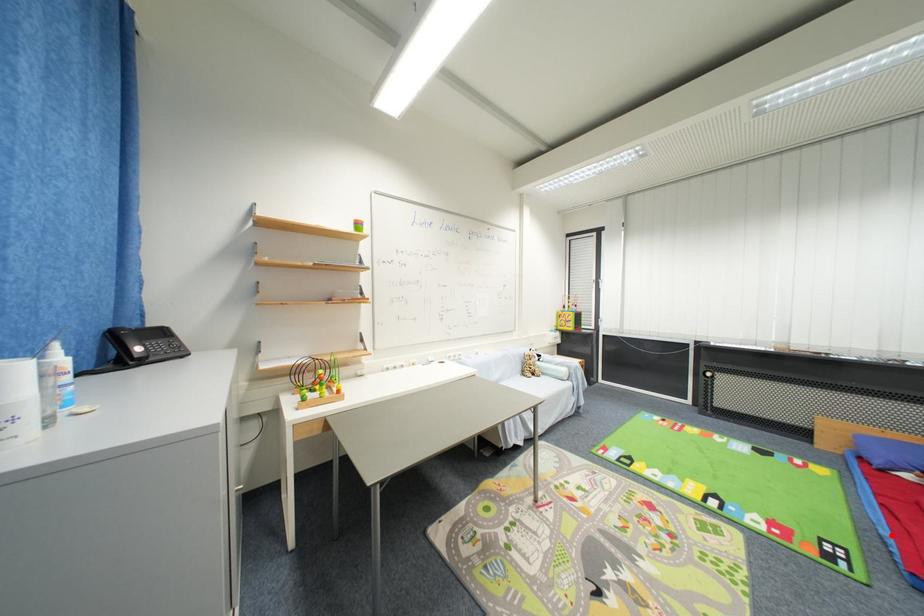
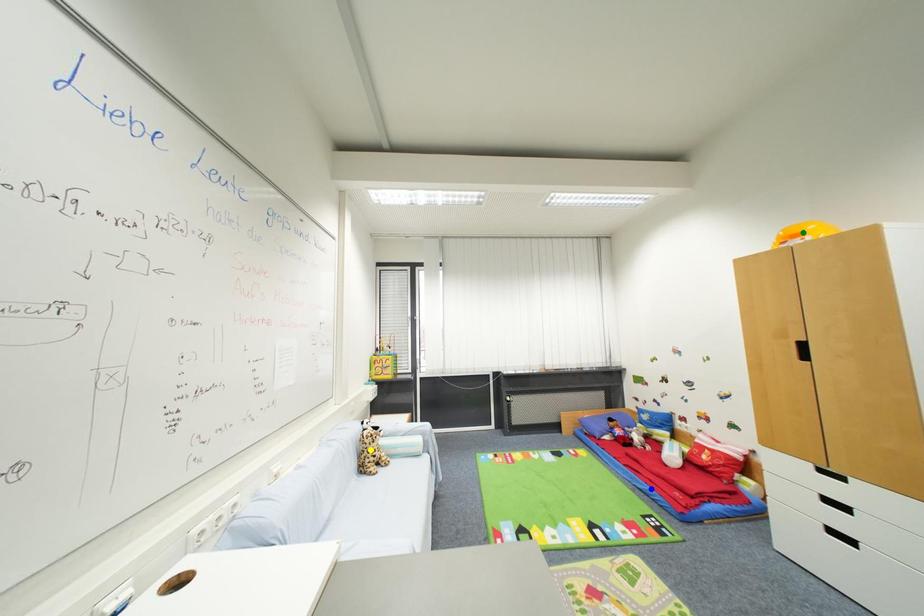
Question: I am providing you with two images of the same scene from different viewpoints. A red point is marked on the first image. You are given multiple points on the second image. Which mark in image 2 goes with the point in image 1?

Choices:
 (A) yellow point
 (B) blue point
 (C) green point

Answer: (B)